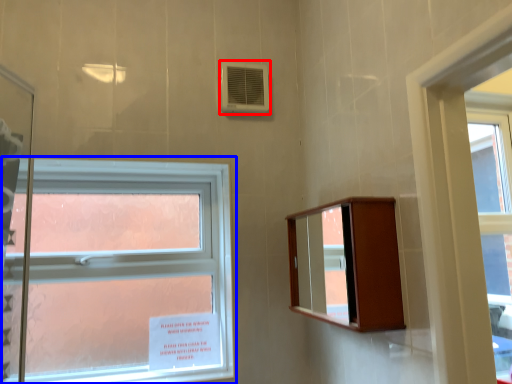
Question: Among these objects, which one is nearest to the camera, air conditioning (highlighted by a red box) or window (highlighted by a blue box)?

Choices:
 (A) air conditioning
 (B) window

Answer: (B)